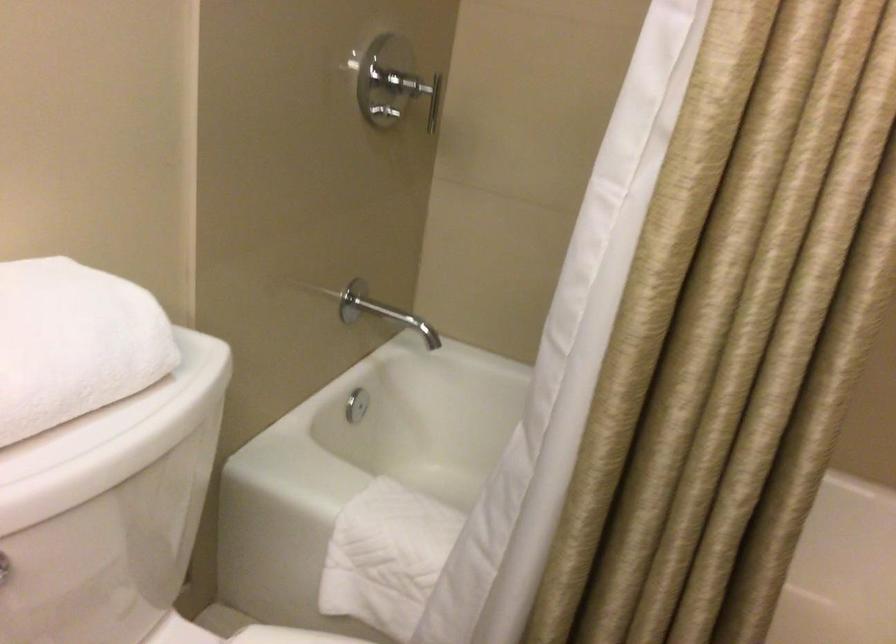
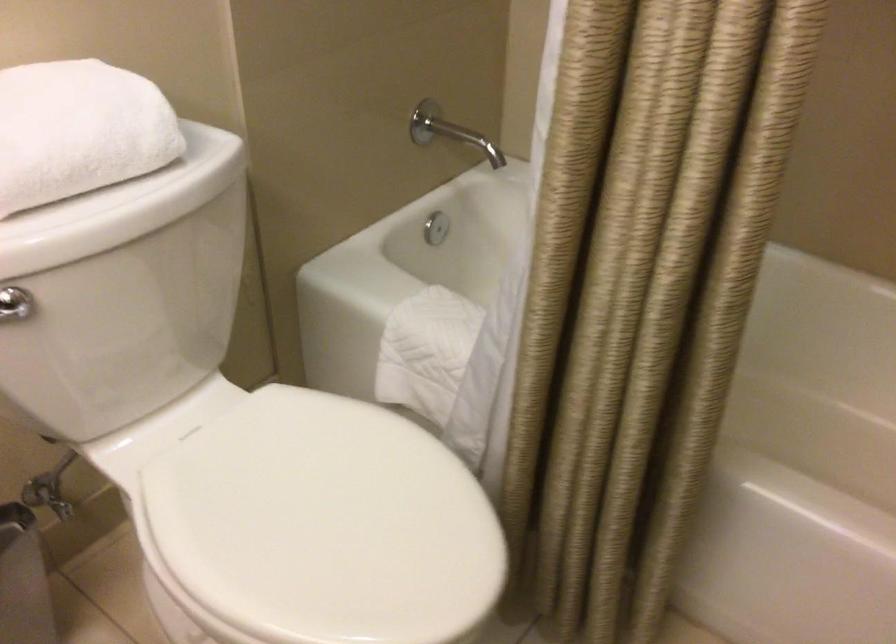
Question: What movement of the cameraman would produce the second image?

Choices:
 (A) Left
 (B) Right
 (C) Forward
 (D) Backward

Answer: (B)